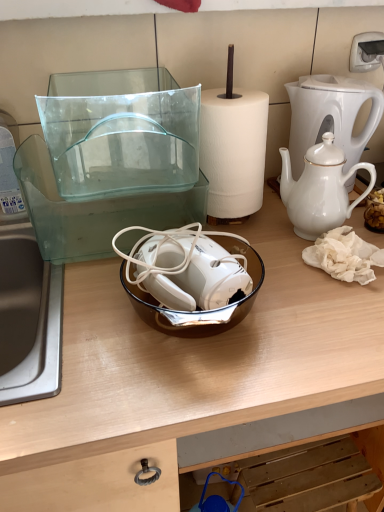
Question: Is silver metallic sink at left wider or thinner than transparent glass bowl at center?

Choices:
 (A) wide
 (B) thin

Answer: (B)

Question: Based on their sizes in the image, would you say silver metallic sink at left is bigger or smaller than transparent glass bowl at center?

Choices:
 (A) big
 (B) small

Answer: (B)

Question: Estimate the real-world distances between objects in this image. Which object is closer to the silver metallic sink at left?

Choices:
 (A) white glossy coffee maker at upper right
 (B) brown glass bowl at center
 (C) transparent glass bowl at center
 (D) white glossy jar at right
 (E) white porcelain teapot at right

Answer: (C)

Question: Estimate the real-world distances between objects in this image. Which object is farther from the white porcelain teapot at right?

Choices:
 (A) silver metallic sink at left
 (B) brown glass bowl at center
 (C) white glossy coffee maker at upper right
 (D) white glossy jar at right
 (E) transparent glass bowl at center

Answer: (A)